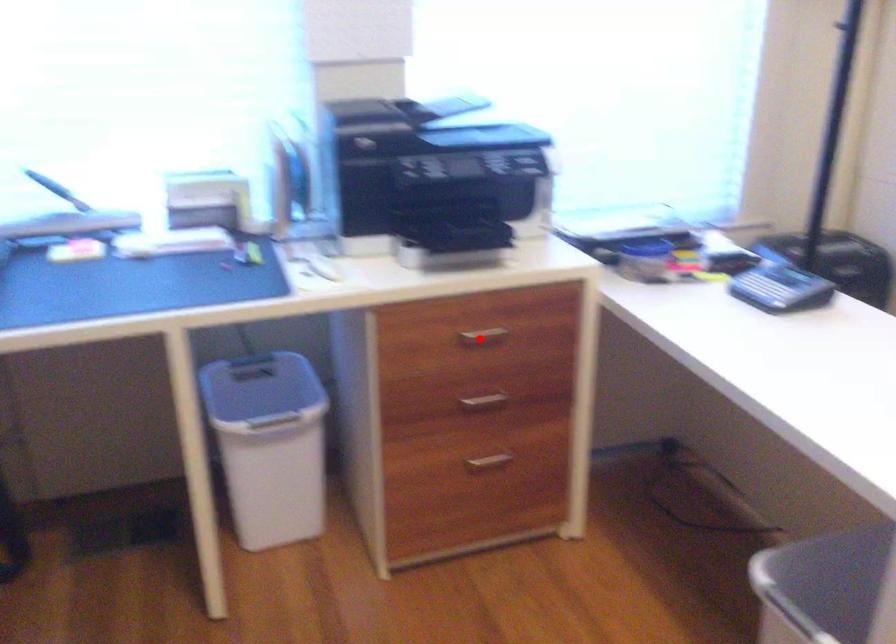
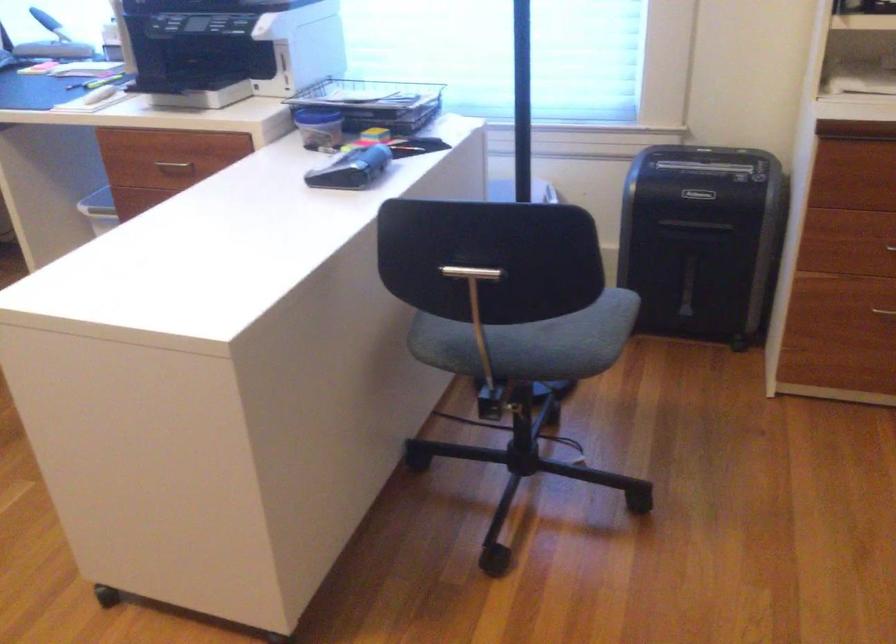
Question: I am providing you with two images of the same scene from different viewpoints. A red point is shown in image1. For the corresponding object point in image2, is it positioned nearer or farther from the camera?

Choices:
 (A) Nearer
 (B) Farther

Answer: (B)